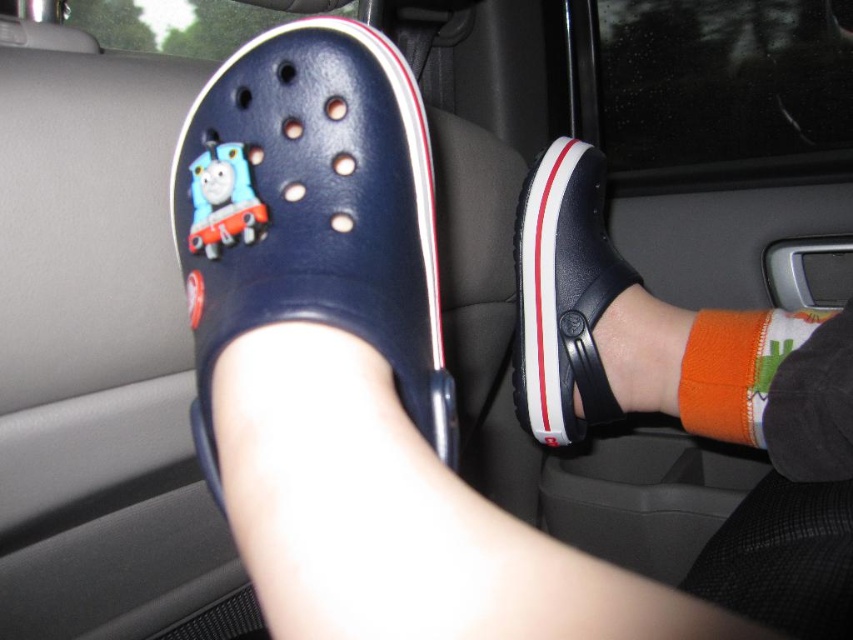
You are a fashion designer observing the car interior. You need to determine which item is higher in position between the orange knitted sock at lower right and the blue matte thomas the tank engine at left. Can you identify which one is taller?

The orange knitted sock at lower right is taller than the blue matte thomas the tank engine at left according to the description.

You are trying to fit both the navy rubber croc at center and the blue matte thomas the tank engine at left into a small storage box. Based on their sizes, which one might not fit if the box is only wide enough for the narrower object?

The navy rubber croc at center might not fit into the storage box because it is wider than the blue matte thomas the tank engine at left.